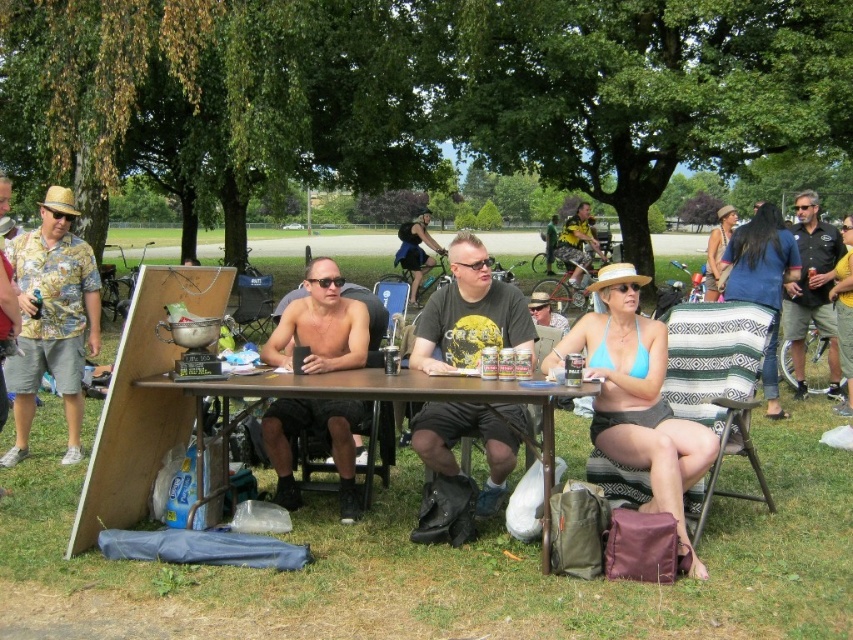
Question: Which object is closer to the camera taking this photo?

Choices:
 (A) brown wooden table at center
 (B) black leather jacket at upper right
 (C) yellow printed t-shirt at center

Answer: (A)

Question: Estimate the real-world distances between objects in this image. Which object is farther from the black leather jacket at upper right?

Choices:
 (A) brown wooden table at center
 (B) shiny black shorts at center

Answer: (A)

Question: In this image, where is shiny black shorts at center located relative to brown wooden table at center?

Choices:
 (A) right
 (B) left

Answer: (B)

Question: Can you confirm if yellow printed t-shirt at center is wider than black leather jacket at upper right?

Choices:
 (A) no
 (B) yes

Answer: (A)

Question: Where is floral shirt at left located in relation to brown wooden table at center in the image?

Choices:
 (A) right
 (B) left

Answer: (B)

Question: Which point is farther to the camera?

Choices:
 (A) black leather jacket at upper right
 (B) brown wooden table at center
 (C) shiny black shorts at center

Answer: (A)